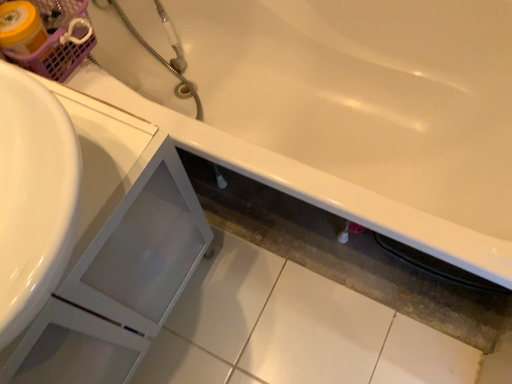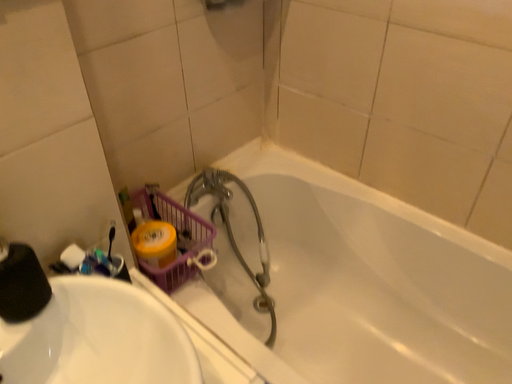
Question: Which way did the camera rotate in the video?

Choices:
 (A) rotated downward
 (B) rotated upward

Answer: (B)